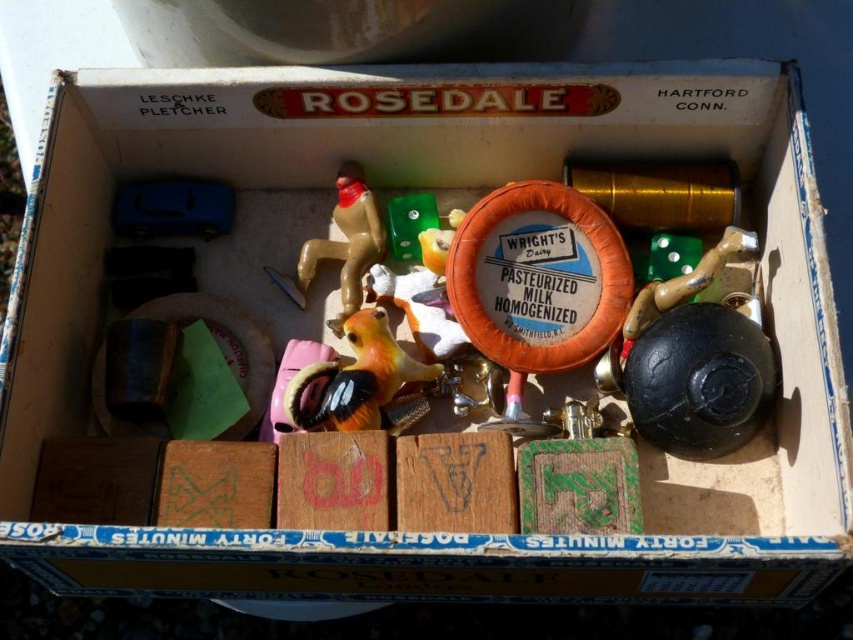
Who is shorter, matte orange plastic toy at center or brown plastic monkey at center?

Standing shorter between the two is matte orange plastic toy at center.

Does matte orange plastic toy at center have a smaller size compared to brown plastic monkey at center?

Indeed, matte orange plastic toy at center has a smaller size compared to brown plastic monkey at center.

Image resolution: width=853 pixels, height=640 pixels. Identify the location of matte orange plastic toy at center. (357, 380).